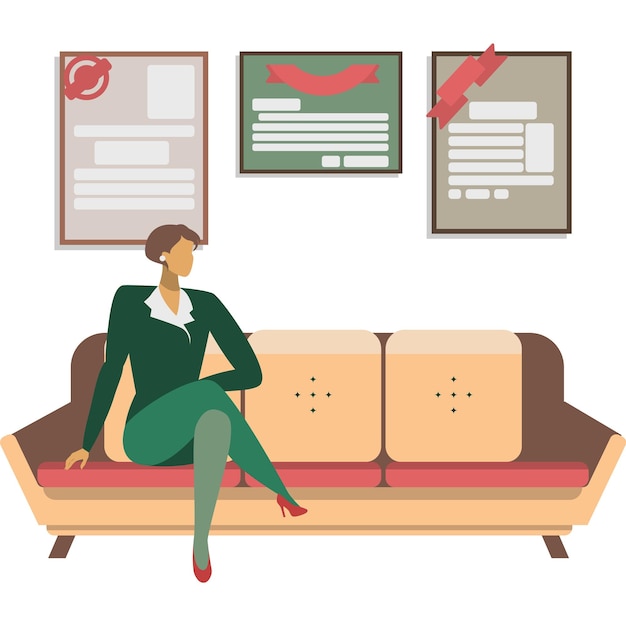
The height and width of the screenshot is (626, 626). I want to click on wall, so click(x=347, y=227).